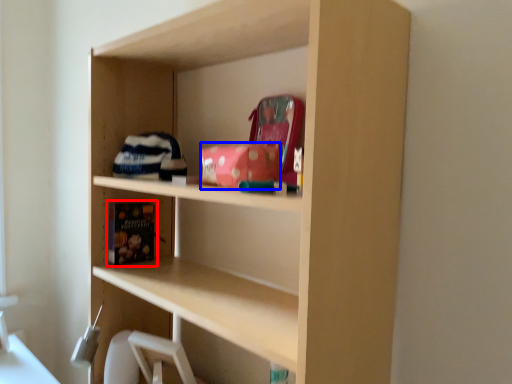
Question: Which object is closer to the camera taking this photo, book (highlighted by a red box) or book (highlighted by a blue box)?

Choices:
 (A) book
 (B) book

Answer: (B)